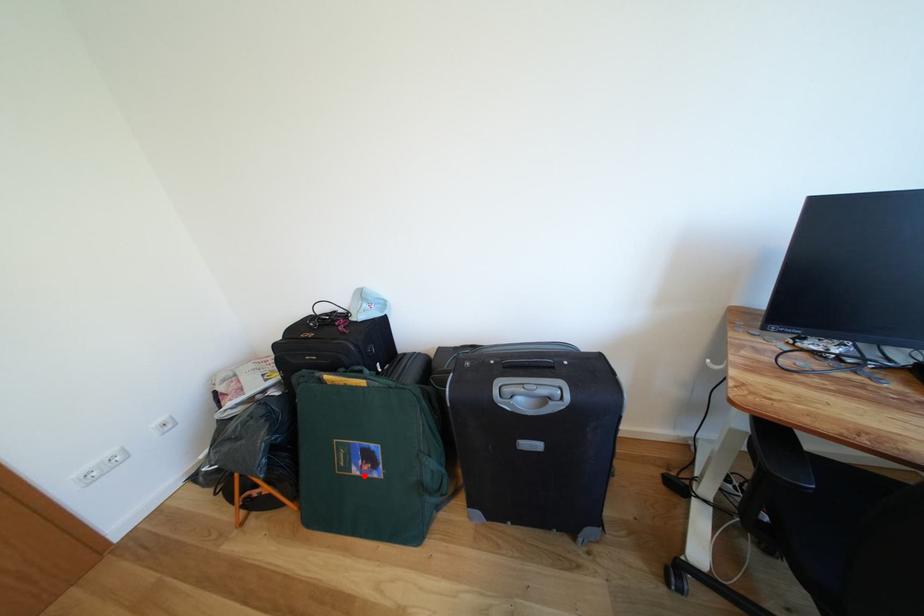
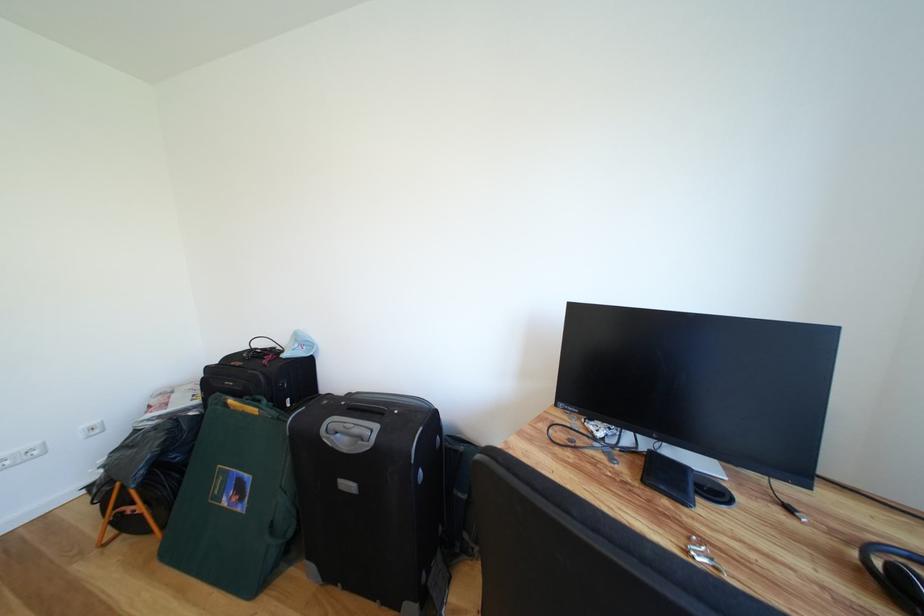
Question: I am providing you with two images of the same scene from different viewpoints. In image1, a red point is highlighted. Considering the same 3D point in image2, which of the following is correct?

Choices:
 (A) It is closer
 (B) It is farther

Answer: (A)